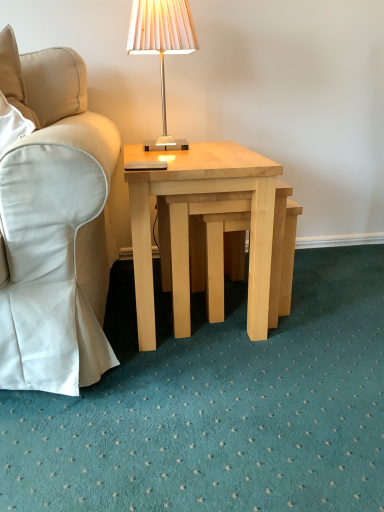
The image size is (384, 512). Find the location of `vacant space in front of light wood step stool at center`. vacant space in front of light wood step stool at center is located at coordinates (239, 369).